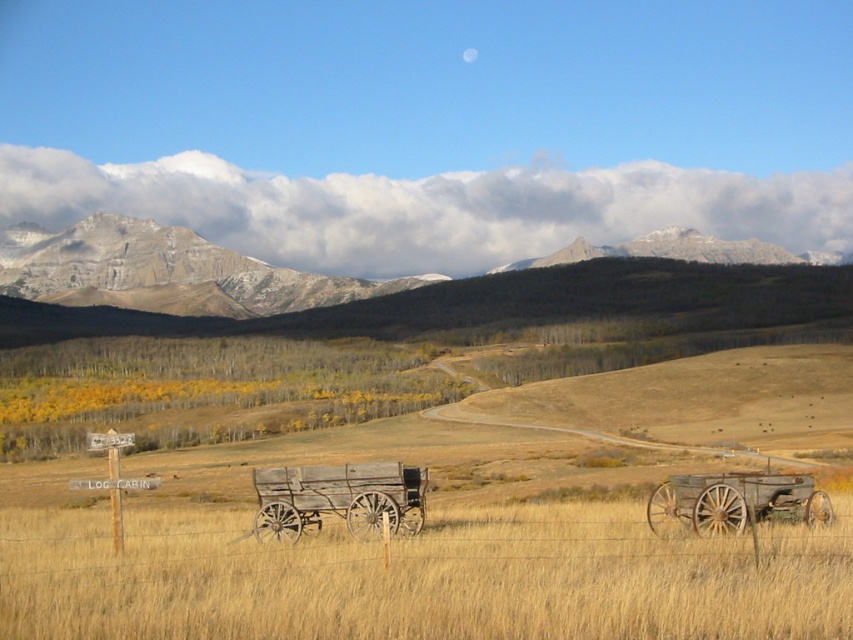
Question: Is dry grass at center closer to the viewer compared to rustic wood wagon at right?

Choices:
 (A) yes
 (B) no

Answer: (A)

Question: Estimate the real-world distances between objects in this image. Which object is closer to the dry grass at center?

Choices:
 (A) rustic wood wagon at right
 (B) rocky gray mountains at upper center
 (C) weathered wood wagon at center

Answer: (C)

Question: Can you confirm if rocky gray mountains at upper center is thinner than rustic wood wagon at right?

Choices:
 (A) yes
 (B) no

Answer: (B)

Question: Estimate the real-world distances between objects in this image. Which object is farther from the dry grass at center?

Choices:
 (A) rocky gray mountains at upper center
 (B) rustic wood wagon at right

Answer: (A)

Question: Among these objects, which one is farthest from the camera?

Choices:
 (A) rocky gray mountains at upper center
 (B) dry grass at center

Answer: (A)

Question: Can you confirm if rocky gray mountains at upper center is wider than weathered wood wagon at center?

Choices:
 (A) no
 (B) yes

Answer: (B)